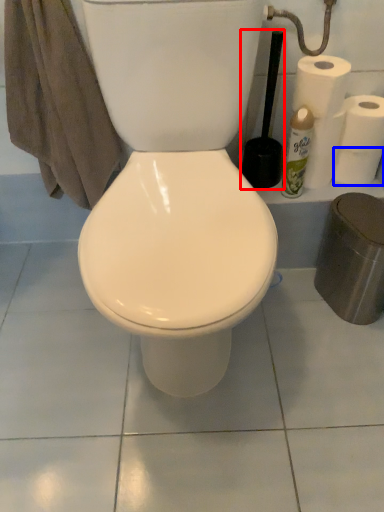
Question: Which object appears closest to the camera in this image, brush (highlighted by a red box) or paper towel (highlighted by a blue box)?

Choices:
 (A) brush
 (B) paper towel

Answer: (A)